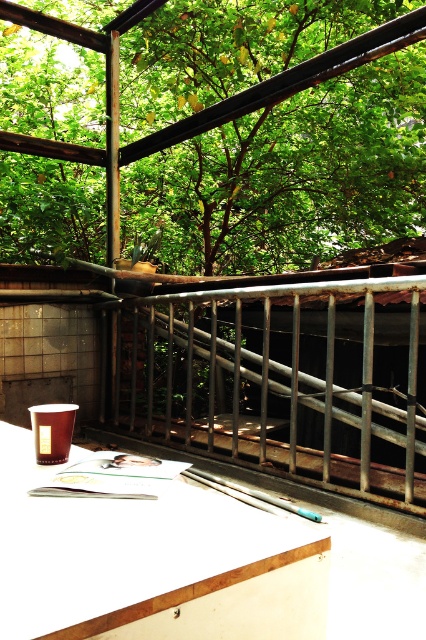
Question: Does green leafy tree at upper center have a larger size compared to white glossy ledge at lower center?

Choices:
 (A) no
 (B) yes

Answer: (B)

Question: Which object is the closest to the metallic silver skateboard at center?

Choices:
 (A) rusty metal railing at center
 (B) green leafy tree at upper center

Answer: (A)

Question: Which point appears farthest from the camera in this image?

Choices:
 (A) (141, 92)
 (B) (109, 461)
 (C) (186, 429)

Answer: (A)

Question: Does green leafy tree at upper center have a smaller size compared to white glossy ledge at lower center?

Choices:
 (A) no
 (B) yes

Answer: (A)

Question: Can you confirm if green leafy tree at upper center is thinner than rusty metal railing at center?

Choices:
 (A) yes
 (B) no

Answer: (B)

Question: Estimate the real-world distances between objects in this image. Which object is closer to the white glossy ledge at lower center?

Choices:
 (A) green leafy tree at upper center
 (B) metallic silver skateboard at center
 (C) rusty metal railing at center

Answer: (B)